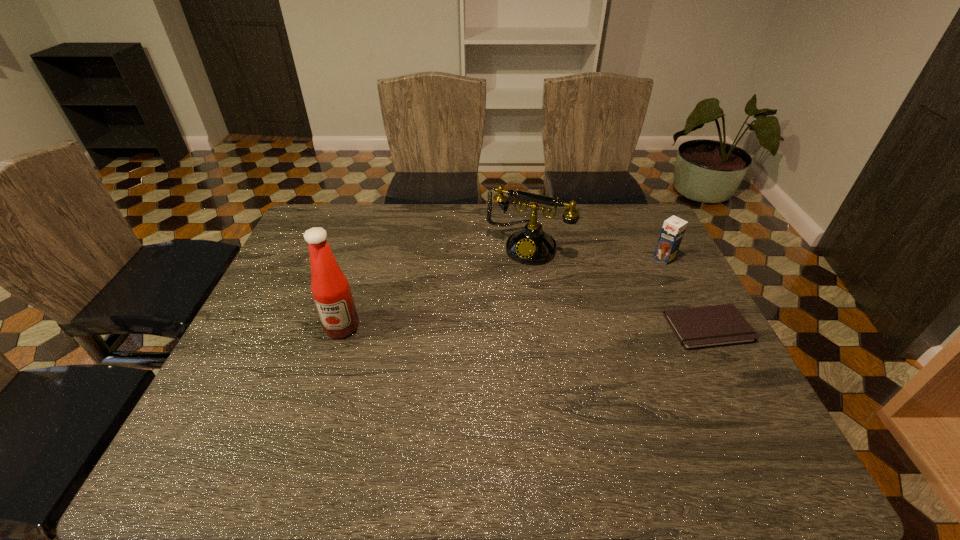
The image size is (960, 540). I want to click on free spot between the condiment and the third shortest object, so click(x=435, y=286).

Find the location of a particular element. object that is the closest to the shortest object is located at coordinates (673, 229).

Locate an element on the screen. Image resolution: width=960 pixels, height=540 pixels. object that stands as the second closest to the third tallest object is located at coordinates (531, 245).

Where is `vacant point that satisfies the following two spatial constraints: 1. on the front side of the third shortest object; 2. on the left side of the second shortest object`? This screenshot has height=540, width=960. vacant point that satisfies the following two spatial constraints: 1. on the front side of the third shortest object; 2. on the left side of the second shortest object is located at coordinates (530, 258).